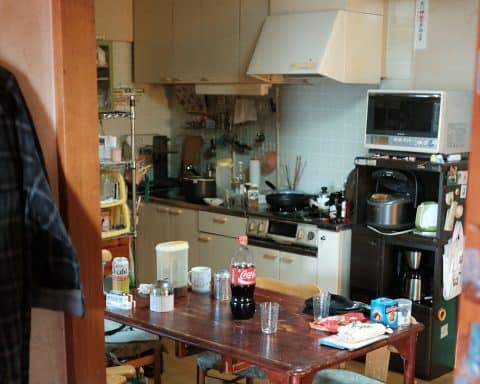
The height and width of the screenshot is (384, 480). Find the location of `table`. table is located at coordinates (226, 329).